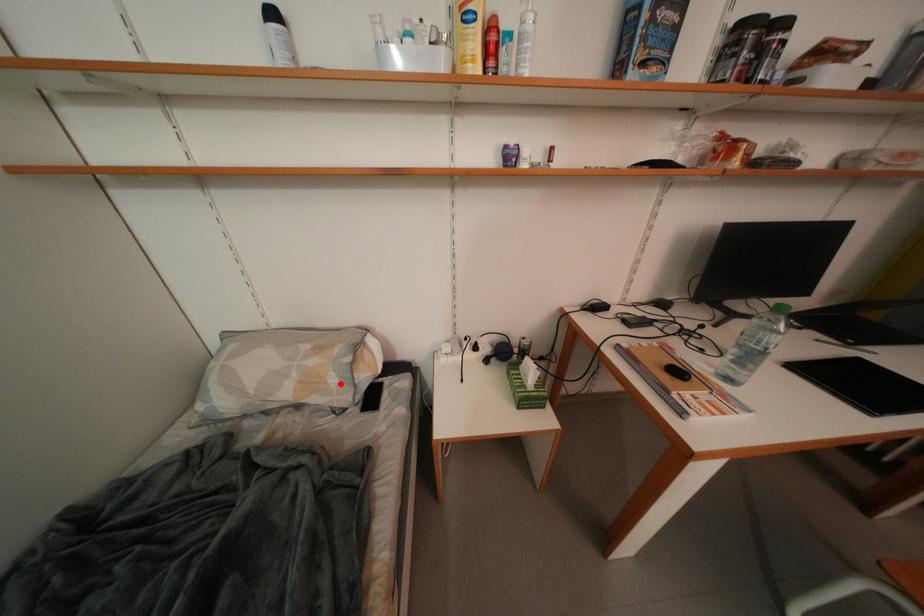
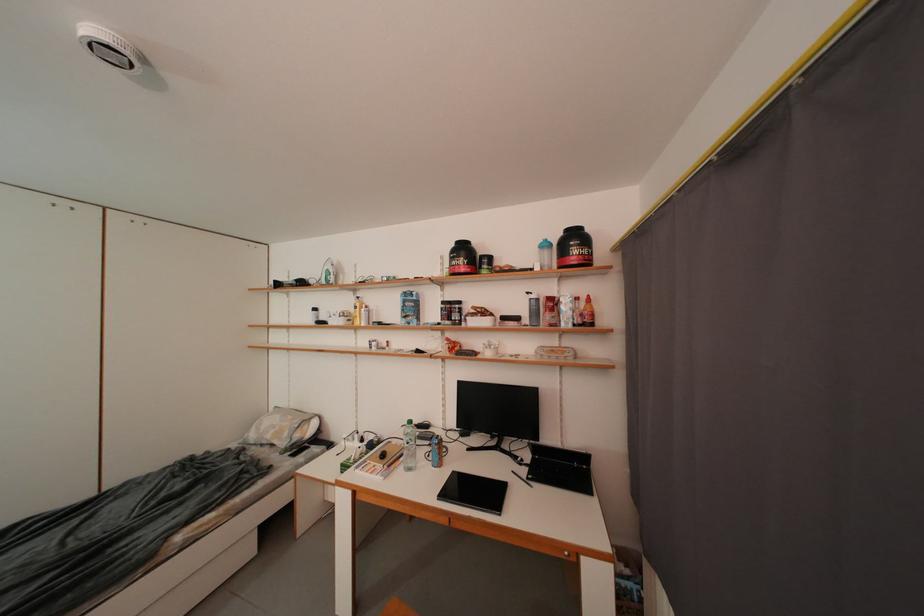
Question: I am providing you with two images of the same scene from different viewpoints. A red point is marked on the first image. Is the red point's position out of view in image 2?

Choices:
 (A) Yes
 (B) No

Answer: (B)